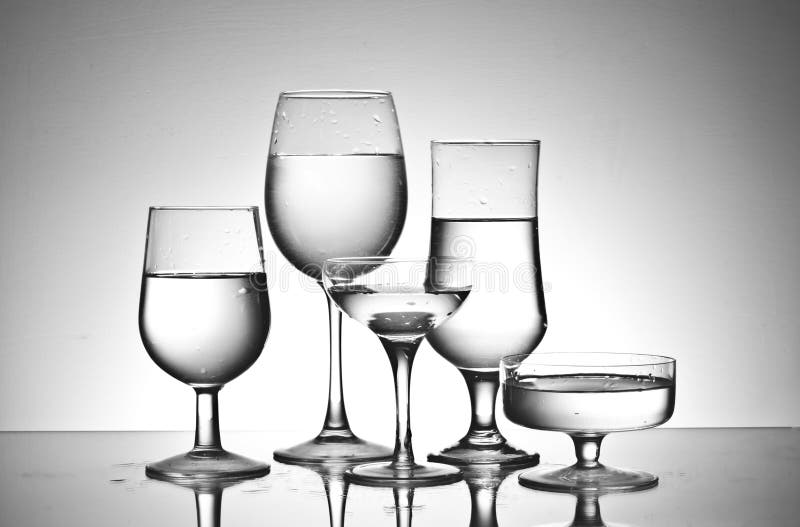
Locate an element on the screen. This screenshot has width=800, height=527. wine glasses is located at coordinates (216, 329), (316, 203), (381, 298), (492, 270), (580, 392).